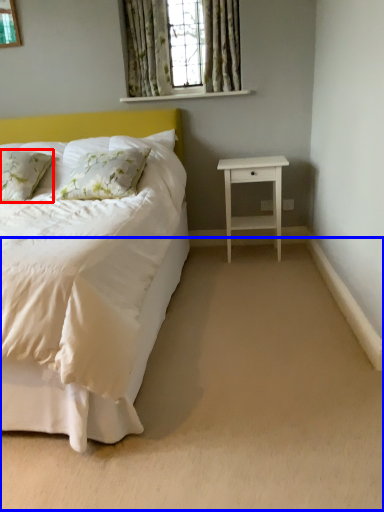
Question: Which of the following is the farthest to the observer, pillow (highlighted by a red box) or plain (highlighted by a blue box)?

Choices:
 (A) pillow
 (B) plain

Answer: (A)